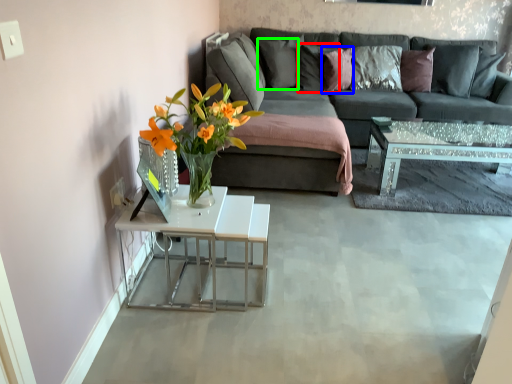
Question: Considering the real-world distances, which object is farthest from pillow (highlighted by a red box)? pillow (highlighted by a blue box) or pillow (highlighted by a green box)?

Choices:
 (A) pillow
 (B) pillow

Answer: (B)